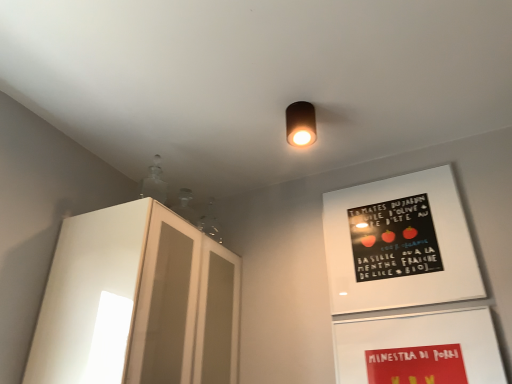
Question: From a real-world perspective, is matte white bulletin board at lower right, the second bulletin board viewed from the top, above or below white glossy cabinet at left?

Choices:
 (A) above
 (B) below

Answer: (B)

Question: Visually, is matte white bulletin board at lower right, the second bulletin board viewed from the top, positioned to the left or to the right of white glossy cabinet at left?

Choices:
 (A) left
 (B) right

Answer: (B)

Question: Estimate the real-world distances between objects in this image. Which object is closer to the matte black cylinder at center?

Choices:
 (A) matte black poster at upper right, which is the 2th bulletin board in bottom-to-top order
 (B) matte white bulletin board at lower right, the second bulletin board viewed from the top
 (C) white glossy cabinet at left

Answer: (A)

Question: Which is nearer to the matte black poster at upper right, which is the 2th bulletin board in bottom-to-top order?

Choices:
 (A) matte white bulletin board at lower right, which appears as the 1th bulletin board when ordered from the bottom
 (B) matte black cylinder at center
 (C) white glossy cabinet at left

Answer: (A)